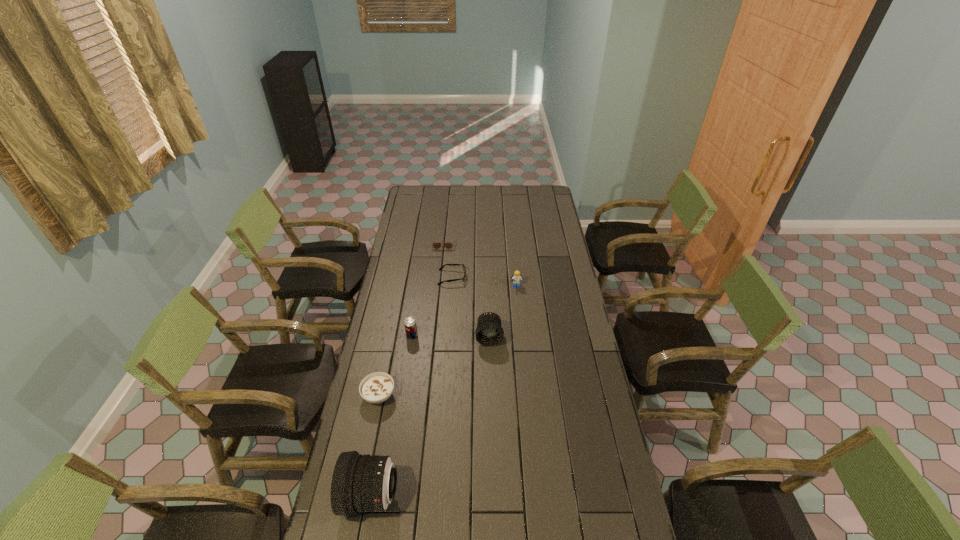
Where is `blank region between the shortest object and the rightmost object`? blank region between the shortest object and the rightmost object is located at coordinates (484, 282).

At what (x,y) coordinates should I click in order to perform the action: click on free space between the beer can and the rightmost object. Please return your answer as a coordinate pair (x, y). Image resolution: width=960 pixels, height=540 pixels. Looking at the image, I should click on (465, 311).

Locate an element on the screen. empty space that is in between the beer can and the sixth farthest object is located at coordinates (396, 366).

At what (x,y) coordinates should I click in order to perform the action: click on free spot between the farthest object and the spectacles. Please return your answer as a coordinate pair (x, y). Looking at the image, I should click on (447, 260).

Find the location of a particular element. The width and height of the screenshot is (960, 540). free space between the shortest object and the Lego is located at coordinates (484, 282).

The width and height of the screenshot is (960, 540). Find the location of `object that is the nearest to the beer can`. object that is the nearest to the beer can is located at coordinates (375, 388).

Point out which object is positioned as the sixth nearest to the third shortest object. Please provide its 2D coordinates. Your answer should be formatted as a tuple, i.e. [(x, y)], where the tuple contains the x and y coordinates of a point satisfying the conditions above.

[(436, 245)]

I want to click on blank space that satisfies the following two spatial constraints: 1. at the front element of the farther telephoto lens; 2. at the front element of the nearer telephoto lens, so click(x=492, y=496).

Locate an element on the screen. The image size is (960, 540). free space that satisfies the following two spatial constraints: 1. on the front side of the beer can; 2. at the front element of the nearest object is located at coordinates (388, 496).

In order to click on free location that satisfies the following two spatial constraints: 1. at the front element of the farther telephoto lens; 2. at the front element of the tallest object in this screenshot , I will do `click(492, 496)`.